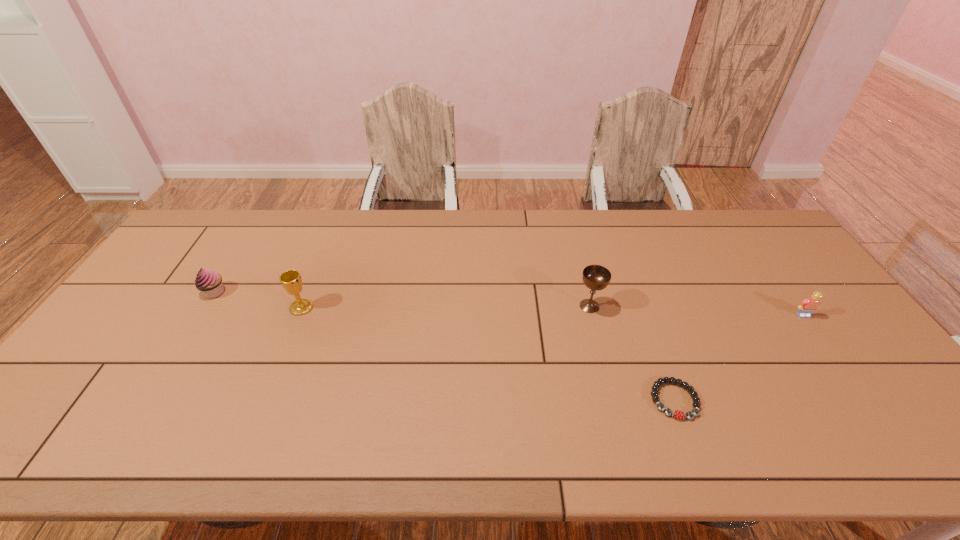
Locate an element on the screen. vacant area between the leftmost object and the left chalice is located at coordinates (258, 300).

What are the coordinates of `vacant region between the left chalice and the bracelet` in the screenshot? It's located at (488, 354).

Locate an element on the screen. vacant point located between the cupcake and the right chalice is located at coordinates (402, 299).

At what (x,y) coordinates should I click in order to perform the action: click on free point between the third object from left to right and the cupcake. Please return your answer as a coordinate pair (x, y). The width and height of the screenshot is (960, 540). Looking at the image, I should click on (402, 299).

Identify the location of vacant area between the right chalice and the fourth object from right to left. (445, 307).

Locate an element on the screen. The width and height of the screenshot is (960, 540). free spot between the nearest object and the left chalice is located at coordinates (488, 354).

Find the location of a particular element. vacant space that is in between the shortest object and the third object from left to right is located at coordinates (632, 353).

Identify which object is the second nearest to the left chalice. Please provide its 2D coordinates. Your answer should be formatted as a tuple, i.e. [(x, y)], where the tuple contains the x and y coordinates of a point satisfying the conditions above.

[(595, 277)]

Locate an element on the screen. The image size is (960, 540). object that stands as the fourth closest to the right chalice is located at coordinates (209, 282).